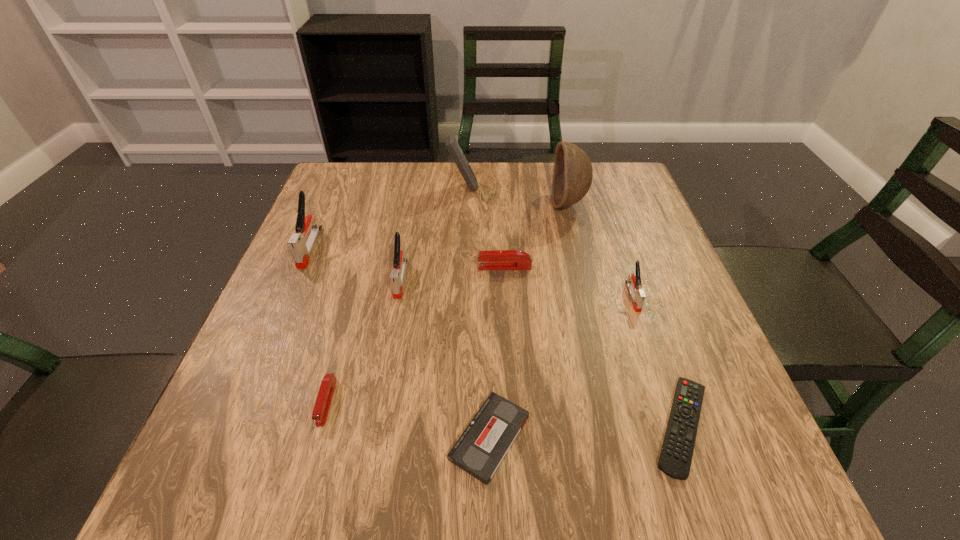
Find the location of `vacant point located 0.310m on the front-facing side of the bigger red stapler`. vacant point located 0.310m on the front-facing side of the bigger red stapler is located at coordinates (340, 267).

Where is `vacant region located 0.240m on the front-facing side of the bigger red stapler`? vacant region located 0.240m on the front-facing side of the bigger red stapler is located at coordinates (372, 267).

Where is `vacant area situated 0.060m on the front-facing side of the smaller red stapler`? This screenshot has height=540, width=960. vacant area situated 0.060m on the front-facing side of the smaller red stapler is located at coordinates click(310, 463).

Identify the location of vacant area situated on the back of the eighth tallest object. The width and height of the screenshot is (960, 540). (488, 353).

Where is `free space located 0.350m on the left of the shortest object`? The width and height of the screenshot is (960, 540). free space located 0.350m on the left of the shortest object is located at coordinates (431, 426).

The image size is (960, 540). In order to click on bowl at the far edge in this screenshot , I will do `click(572, 176)`.

I want to click on calculator at the far edge, so click(451, 143).

Identify the location of videotape positioned at the near edge. (481, 448).

The image size is (960, 540). In order to click on remote control at the near edge in this screenshot , I will do `click(675, 459)`.

In order to click on object at the left edge in this screenshot , I will do `click(301, 250)`.